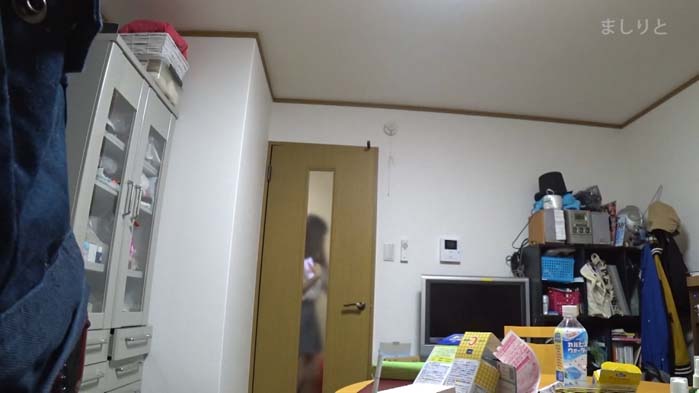
The image size is (699, 393). Identify the location of bottle. (575, 349).